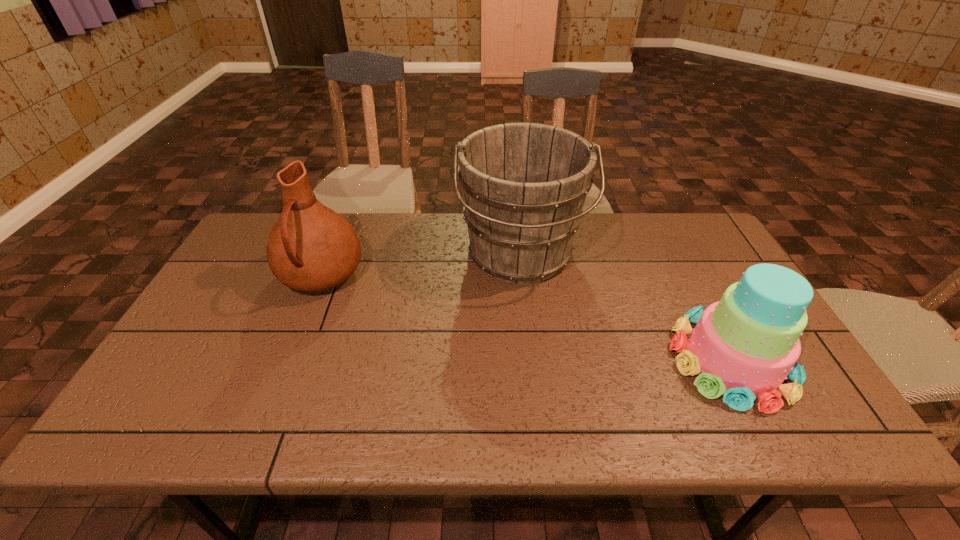
Where is `free point that satisfies the following two spatial constraints: 1. on the handle side of the second object from right to left; 2. on the right side of the nearest object`? free point that satisfies the following two spatial constraints: 1. on the handle side of the second object from right to left; 2. on the right side of the nearest object is located at coordinates (531, 359).

I want to click on free space that satisfies the following two spatial constraints: 1. on the side of the pitcher with the handle; 2. on the left side of the rightmost object, so click(x=288, y=359).

Identify the location of vacant position in the image that satisfies the following two spatial constraints: 1. on the side of the shortest object with the handle; 2. on the right side of the leftmost object. This screenshot has width=960, height=540. (288, 359).

Identify the location of free location that satisfies the following two spatial constraints: 1. on the side of the cake with the handle; 2. on the left side of the pitcher. (288, 359).

Locate an element on the screen. This screenshot has width=960, height=540. free point that satisfies the following two spatial constraints: 1. on the handle side of the second object from left to right; 2. on the right side of the cake is located at coordinates (531, 359).

Locate an element on the screen. The image size is (960, 540). free space that satisfies the following two spatial constraints: 1. on the side of the shortest object with the handle; 2. on the right side of the pitcher is located at coordinates (288, 359).

This screenshot has height=540, width=960. What are the coordinates of `free space that satisfies the following two spatial constraints: 1. on the side of the nearest object with the handle; 2. on the left side of the pitcher` in the screenshot? It's located at (288, 359).